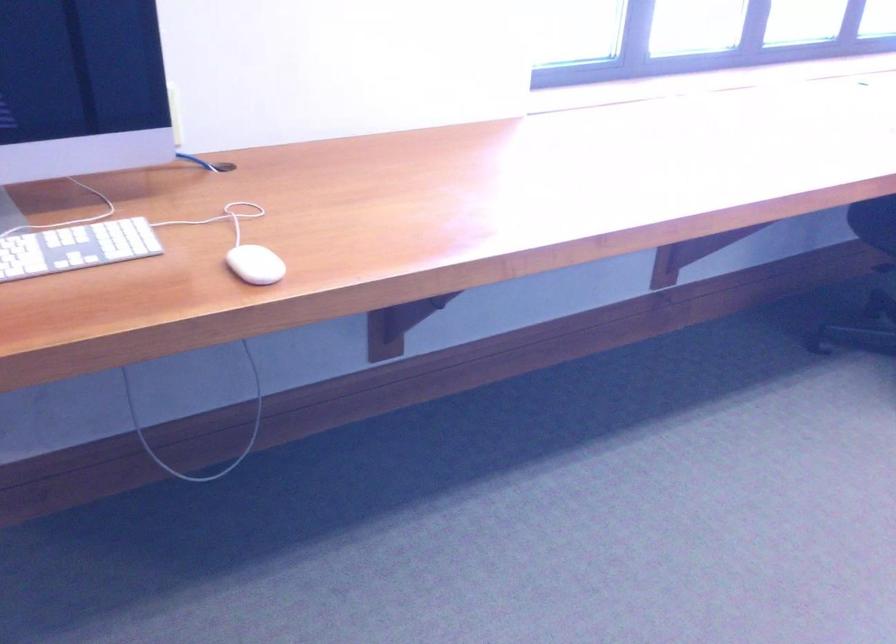
Locate an element on the screen. This screenshot has width=896, height=644. white computer mouse is located at coordinates (254, 265).